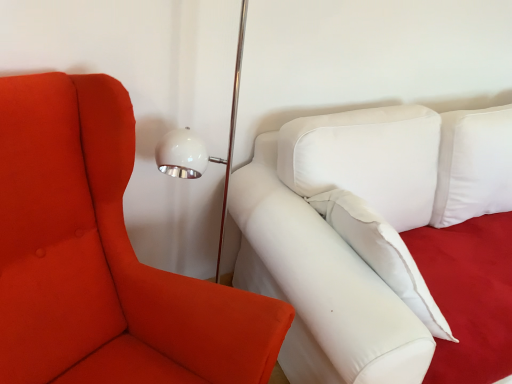
Question: Considering the relative sizes of matte orange fabric chair at left and white fabric studio couch at center in the image provided, is matte orange fabric chair at left wider than white fabric studio couch at center?

Choices:
 (A) no
 (B) yes

Answer: (A)

Question: From a real-world perspective, is matte orange fabric chair at left positioned under white fabric studio couch at center based on gravity?

Choices:
 (A) no
 (B) yes

Answer: (A)

Question: Considering the relative sizes of matte orange fabric chair at left and white fabric studio couch at center in the image provided, is matte orange fabric chair at left shorter than white fabric studio couch at center?

Choices:
 (A) no
 (B) yes

Answer: (A)

Question: Is the depth of matte orange fabric chair at left less than that of white fabric studio couch at center?

Choices:
 (A) yes
 (B) no

Answer: (A)

Question: Would you consider matte orange fabric chair at left to be distant from white fabric studio couch at center?

Choices:
 (A) no
 (B) yes

Answer: (A)

Question: Is matte orange fabric chair at left beside white fabric studio couch at center?

Choices:
 (A) no
 (B) yes

Answer: (A)

Question: Is white fabric studio couch at center not inside matte orange fabric chair at left?

Choices:
 (A) no
 (B) yes

Answer: (B)

Question: Is matte orange fabric chair at left a part of white fabric studio couch at center?

Choices:
 (A) no
 (B) yes

Answer: (A)

Question: Considering the relative sizes of white fabric studio couch at center and matte orange fabric chair at left in the image provided, is white fabric studio couch at center shorter than matte orange fabric chair at left?

Choices:
 (A) yes
 (B) no

Answer: (A)

Question: From the image's perspective, does white fabric studio couch at center appear lower than matte orange fabric chair at left?

Choices:
 (A) yes
 (B) no

Answer: (B)

Question: Is white fabric studio couch at center far from matte orange fabric chair at left?

Choices:
 (A) no
 (B) yes

Answer: (A)

Question: From the image's perspective, is white fabric studio couch at center over matte orange fabric chair at left?

Choices:
 (A) yes
 (B) no

Answer: (A)

Question: From a real-world perspective, relative to matte orange fabric chair at left, is white fabric studio couch at center vertically above or below?

Choices:
 (A) below
 (B) above

Answer: (A)